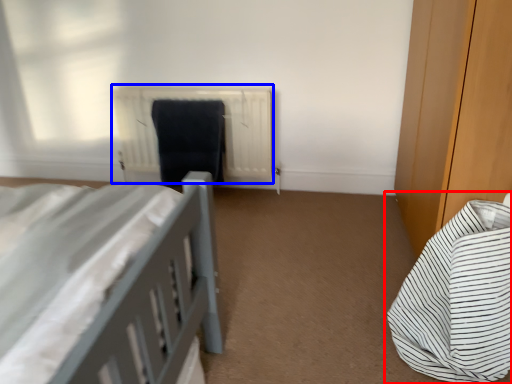
Question: Which of the following is the closest to the observer, bed (highlighted by a red box) or radiator (highlighted by a blue box)?

Choices:
 (A) bed
 (B) radiator

Answer: (A)